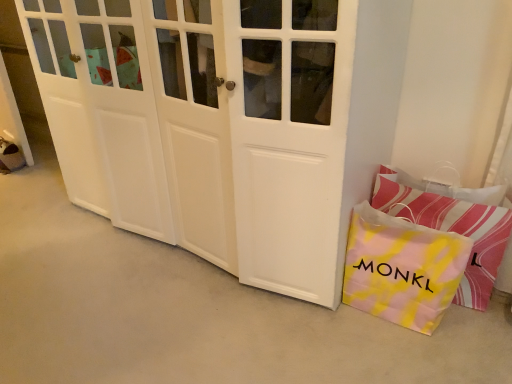
Question: From a real-world perspective, does yellow tie-dye paper bag at lower right stand above white matte door at center?

Choices:
 (A) no
 (B) yes

Answer: (A)

Question: Considering the relative positions of yellow tie-dye paper bag at lower right and white matte door at center in the image provided, is yellow tie-dye paper bag at lower right to the left of white matte door at center from the viewer's perspective?

Choices:
 (A) no
 (B) yes

Answer: (A)

Question: Can you confirm if yellow tie-dye paper bag at lower right is thinner than white matte door at center?

Choices:
 (A) no
 (B) yes

Answer: (B)

Question: Can you confirm if yellow tie-dye paper bag at lower right is positioned to the right of white matte door at center?

Choices:
 (A) yes
 (B) no

Answer: (A)

Question: Can you confirm if yellow tie-dye paper bag at lower right is smaller than white matte door at center?

Choices:
 (A) yes
 (B) no

Answer: (A)

Question: Is yellow tie-dye paper bag at lower right inside or outside of white matte door at center?

Choices:
 (A) inside
 (B) outside

Answer: (B)

Question: Is yellow tie-dye paper bag at lower right bigger or smaller than white matte door at center?

Choices:
 (A) big
 (B) small

Answer: (B)

Question: From the image's perspective, is yellow tie-dye paper bag at lower right positioned above or below white matte door at center?

Choices:
 (A) below
 (B) above

Answer: (A)

Question: Is yellow tie-dye paper bag at lower right in front of or behind white matte door at center in the image?

Choices:
 (A) front
 (B) behind

Answer: (B)

Question: Is white matte door at center bigger or smaller than pink striped pillow at lower right?

Choices:
 (A) big
 (B) small

Answer: (A)

Question: Is white matte door at center spatially inside pink striped pillow at lower right, or outside of it?

Choices:
 (A) outside
 (B) inside

Answer: (A)

Question: Considering their positions, is white matte door at center located in front of or behind pink striped pillow at lower right?

Choices:
 (A) behind
 (B) front

Answer: (B)

Question: Based on their positions, is white matte door at center located to the left or right of pink striped pillow at lower right?

Choices:
 (A) right
 (B) left

Answer: (B)

Question: Is pink striped pillow at lower right taller or shorter than white matte door at center?

Choices:
 (A) short
 (B) tall

Answer: (A)

Question: Looking at their shapes, would you say pink striped pillow at lower right is wider or thinner than white matte door at center?

Choices:
 (A) wide
 (B) thin

Answer: (B)